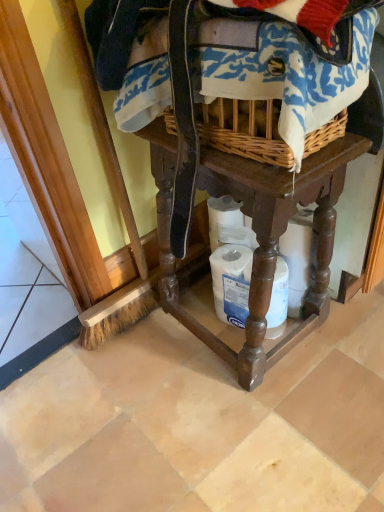
Where is `white matte toilet paper at lower center`? The width and height of the screenshot is (384, 512). white matte toilet paper at lower center is located at coordinates (231, 283).

Is the surface of woven fabric at upper center in direct contact with brown wooden table at center?

There is a gap between woven fabric at upper center and brown wooden table at center.

From a real-world perspective, is woven fabric at upper center above or below brown wooden table at center?

woven fabric at upper center is above brown wooden table at center.

Between woven fabric at upper center and brown wooden table at center, which one has larger size?

brown wooden table at center is bigger.

From the image's perspective, is woven fabric at upper center above brown wooden table at center?

Yes, from the image's perspective, woven fabric at upper center is above brown wooden table at center.

Considering the positions of point (313, 291) and point (157, 61), is point (313, 291) closer or farther from the camera than point (157, 61)?

Point (313, 291) appears to be farther away from the viewer than point (157, 61).

From a real-world perspective, between brown wooden table at center and woven fabric at upper center, who is vertically lower?

brown wooden table at center is physically lower.

I want to click on clothing on the left of brown wooden table at center, so pos(292,75).

Is brown wooden table at center aimed at woven fabric at upper center?

No, brown wooden table at center is not turned towards woven fabric at upper center.

Which is nearer, (272, 323) or (94, 3)?

The point (94, 3) is more forward.

Is white matte toilet paper at lower center at the left side of woven fabric at upper center?

Incorrect, white matte toilet paper at lower center is not on the left side of woven fabric at upper center.

Image resolution: width=384 pixels, height=512 pixels. What are the coordinates of `toilet paper lying below the woven fabric at upper center (from the image's perspective)` in the screenshot? It's located at (231, 283).

Is woven fabric at upper center in contact with white matte toilet paper at lower center?

No, woven fabric at upper center is not next to white matte toilet paper at lower center.

Considering the sizes of woven fabric at upper center and white matte toilet paper at lower center in the image, is woven fabric at upper center taller or shorter than white matte toilet paper at lower center?

woven fabric at upper center is shorter than white matte toilet paper at lower center.

Looking at the image, does woven fabric at upper center seem bigger or smaller compared to white matte toilet paper at lower center?

In the image, woven fabric at upper center appears to be larger than white matte toilet paper at lower center.

From a real-world perspective, which object stands above the other?

woven fabric at upper center is physically above.

Is brown wooden table at center at the back of white matte toilet paper at lower center?

Correct, white matte toilet paper at lower center is looking away from brown wooden table at center.

Considering the sizes of objects white matte toilet paper at lower center and brown wooden table at center in the image provided, who is shorter, white matte toilet paper at lower center or brown wooden table at center?

white matte toilet paper at lower center.

Is white matte toilet paper at lower center with brown wooden table at center?

No.

This screenshot has height=512, width=384. What are the coordinates of `furniture above the white matte toilet paper at lower center (from a real-world perspective)` in the screenshot? It's located at (271, 242).

Is point (229, 358) closer or farther from the camera than point (278, 262)?

Point (229, 358) appears to be farther away from the viewer than point (278, 262).

How distant is brown wooden table at center from white matte toilet paper at lower center?

brown wooden table at center is 14.71 centimeters away from white matte toilet paper at lower center.

Is brown wooden table at center positioned far away from white matte toilet paper at lower center?

No.

From a real-world perspective, is brown wooden table at center positioned above or below white matte toilet paper at lower center?

brown wooden table at center is situated higher than white matte toilet paper at lower center in the real world.

At what (x,y) coordinates should I click in order to perform the action: click on furniture on the right of woven fabric at upper center. Please return your answer as a coordinate pair (x, y). Looking at the image, I should click on (271, 242).

Where is `furniture below the woven fabric at upper center (from a real-world perspective)`? furniture below the woven fabric at upper center (from a real-world perspective) is located at coordinates (271, 242).

When comparing their distances from white matte toilet paper at lower center, does brown wooden table at center or woven fabric at upper center seem further?

Based on the image, woven fabric at upper center appears to be further to white matte toilet paper at lower center.

Based on their spatial positions, is white matte toilet paper at lower center or woven fabric at upper center further from brown wooden table at center?

woven fabric at upper center lies further to brown wooden table at center than the other object.

Considering their positions, is woven fabric at upper center positioned closer to brown wooden table at center than white matte toilet paper at lower center?

white matte toilet paper at lower center is positioned closer to the anchor brown wooden table at center.

Based on their spatial positions, is brown wooden table at center or white matte toilet paper at lower center further from woven fabric at upper center?

white matte toilet paper at lower center is positioned further to the anchor woven fabric at upper center.

When comparing their distances from woven fabric at upper center, does white matte toilet paper at lower center or brown wooden table at center seem closer?

brown wooden table at center is closer to woven fabric at upper center.

When comparing their distances from white matte toilet paper at lower center, does woven fabric at upper center or brown wooden table at center seem further?

The object further to white matte toilet paper at lower center is woven fabric at upper center.

Find the location of a particular element. furniture between woven fabric at upper center and white matte toilet paper at lower center along the z-axis is located at coordinates (271, 242).